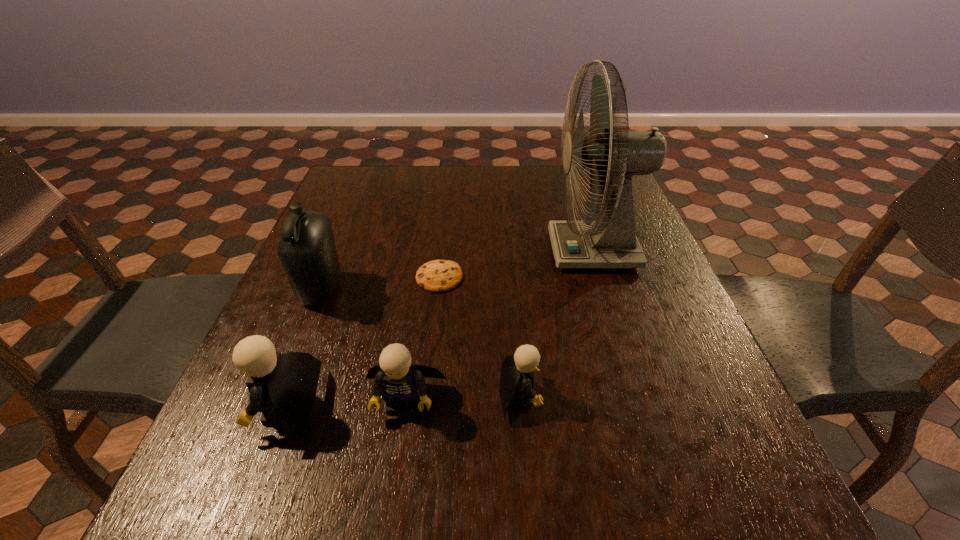
Please point a spot on the right to add another Lego. Please provide its 2D coordinates. Your answer should be formatted as a tuple, i.e. [(x, y)], where the tuple contains the x and y coordinates of a point satisfying the conditions above.

[(631, 388)]